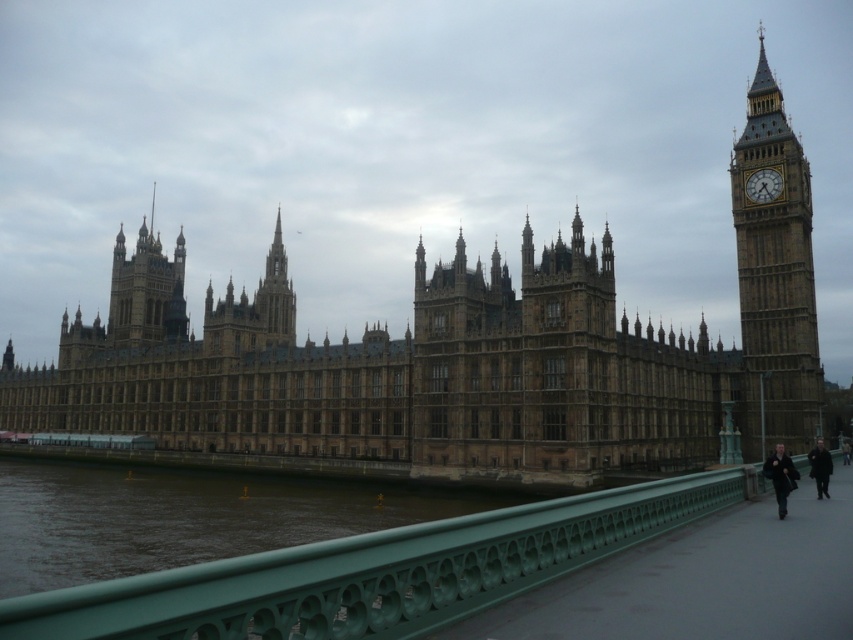
What are the coordinates of the brown stone castle at center in the image?

The brown stone castle at center is located at point [390,371].

You are standing at the entrance of the Palace of Westminster and want to take a photo of the green metal railing at lower center. According to the coordinates provided, where exactly is the green metal railing positioned?

The green metal railing at lower center is located at point (x=373, y=572).